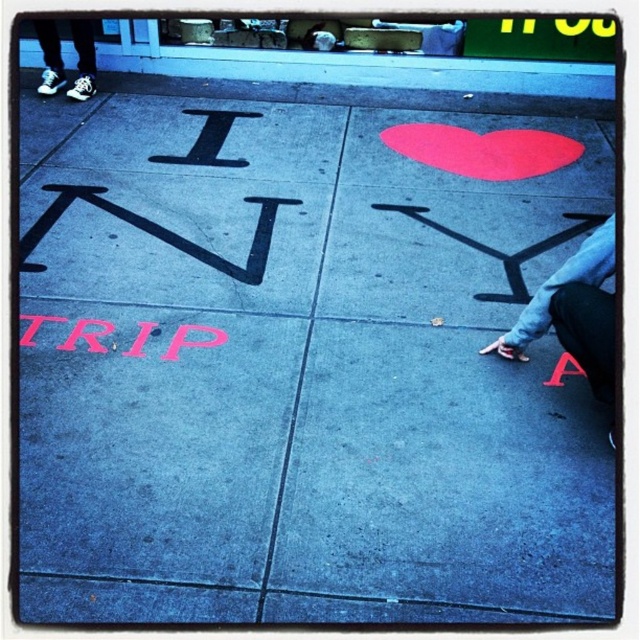
Question: Which object is farther from the camera taking this photo?

Choices:
 (A) pink matte trip at lower left
 (B) white canvas sneakers at upper left

Answer: (B)

Question: Which object appears closest to the camera in this image?

Choices:
 (A) pink matte trip at lower left
 (B) blue concrete curb at upper left

Answer: (A)

Question: Is blue concrete curb at upper left thinner than pink matte trip at lower left?

Choices:
 (A) yes
 (B) no

Answer: (B)

Question: Can you confirm if blue concrete curb at upper left is positioned to the right of pink matte trip at lower left?

Choices:
 (A) no
 (B) yes

Answer: (B)

Question: Which object is positioned farthest from the pink matte trip at lower left?

Choices:
 (A) light blue jeans at lower right
 (B) white canvas sneakers at upper left
 (C) blue concrete curb at upper left

Answer: (C)

Question: In this image, where is blue concrete curb at upper left located relative to pink matte trip at lower left?

Choices:
 (A) left
 (B) right

Answer: (B)